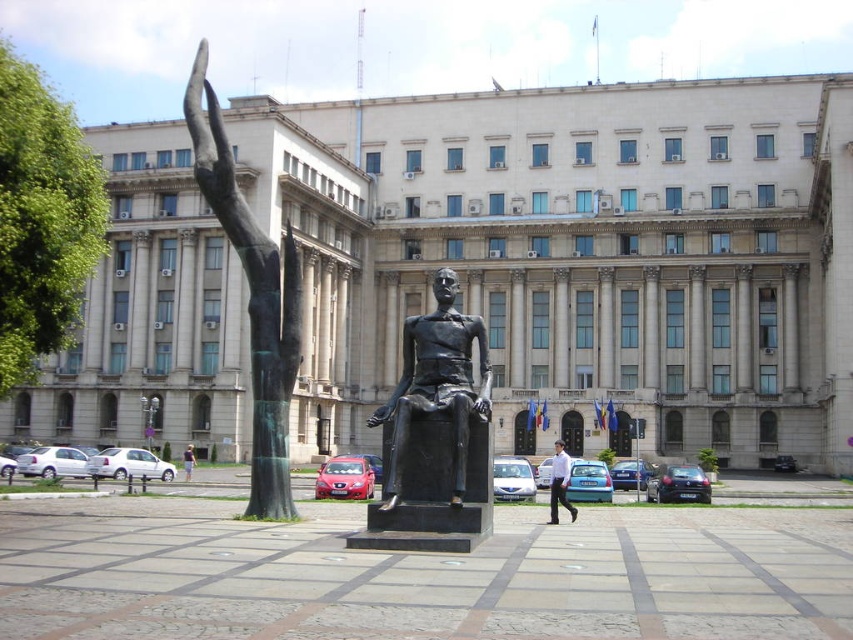
Question: Among these objects, which one is nearest to the camera?

Choices:
 (A) light brown hair at lower left
 (B) bronze statue at left
 (C) white shirt at center
 (D) bronze statue at center

Answer: (D)

Question: Which object is the closest to the white shirt at center?

Choices:
 (A) bronze statue at left
 (B) light brown hair at lower left

Answer: (B)

Question: Can you confirm if bronze statue at center is thinner than light brown hair at lower left?

Choices:
 (A) no
 (B) yes

Answer: (A)

Question: Which object is positioned farthest from the light brown hair at lower left?

Choices:
 (A) bronze statue at center
 (B) white shirt at center
 (C) bronze statue at left

Answer: (A)

Question: Is white shirt at center below light brown hair at lower left?

Choices:
 (A) yes
 (B) no

Answer: (B)

Question: Is bronze statue at center below light brown hair at lower left?

Choices:
 (A) yes
 (B) no

Answer: (B)